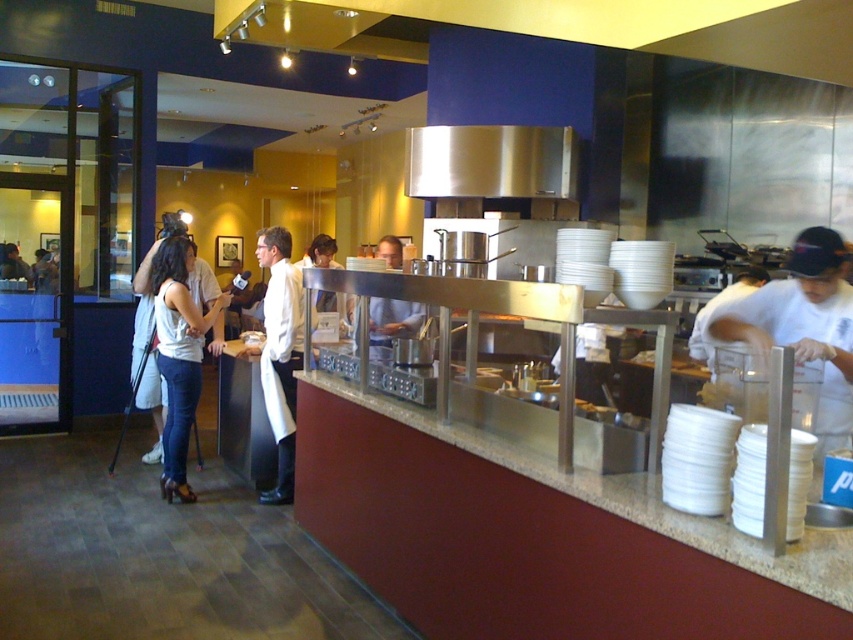
You are a customer trying to place an order at the marble countertop at center. The server is wearing a white matte shirt at right. Can you tell me which one is wider from your perspective?

The marble countertop at center is wider than the white matte shirt at right.

You are standing in the food service area and want to move from point A to point B. The coordinates for point A are point (287, 291) and point B are point (379, 336). Which point is closer to you when you first arrive?

Point (287, 291) is closer to the viewer than point (379, 336), so point A is closer when you first arrive.